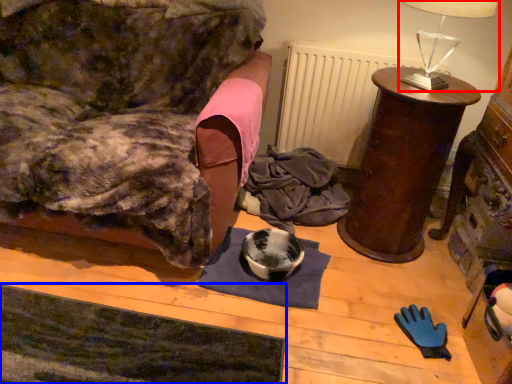
Question: Among these objects, which one is nearest to the camera, table lamp (highlighted by a red box) or yoga mat (highlighted by a blue box)?

Choices:
 (A) table lamp
 (B) yoga mat

Answer: (B)